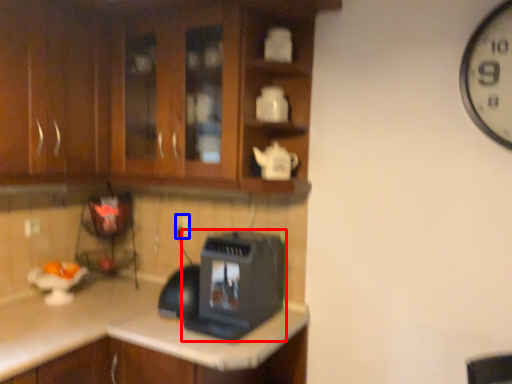
Question: Among these objects, which one is nearest to the camera, home appliance (highlighted by a red box) or electric outlet (highlighted by a blue box)?

Choices:
 (A) home appliance
 (B) electric outlet

Answer: (A)